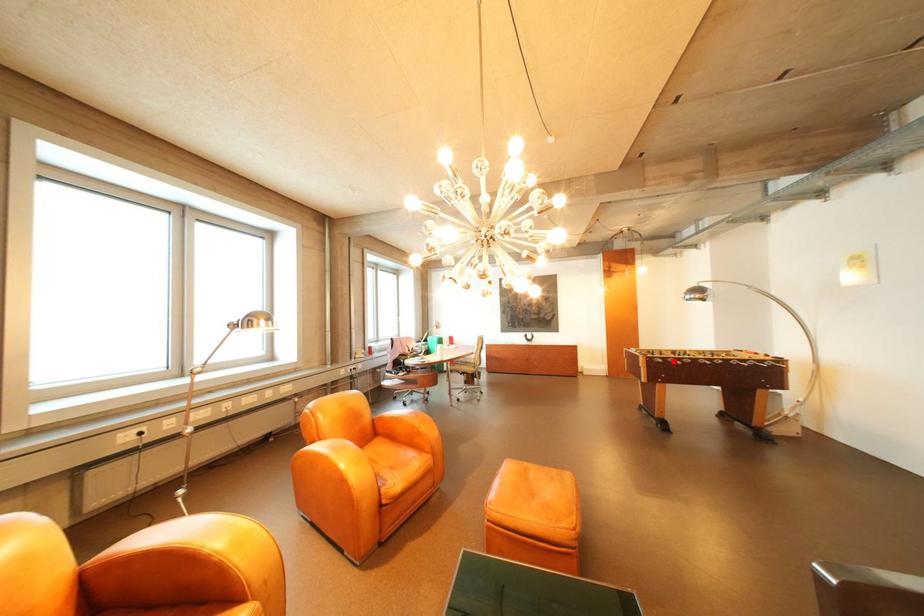
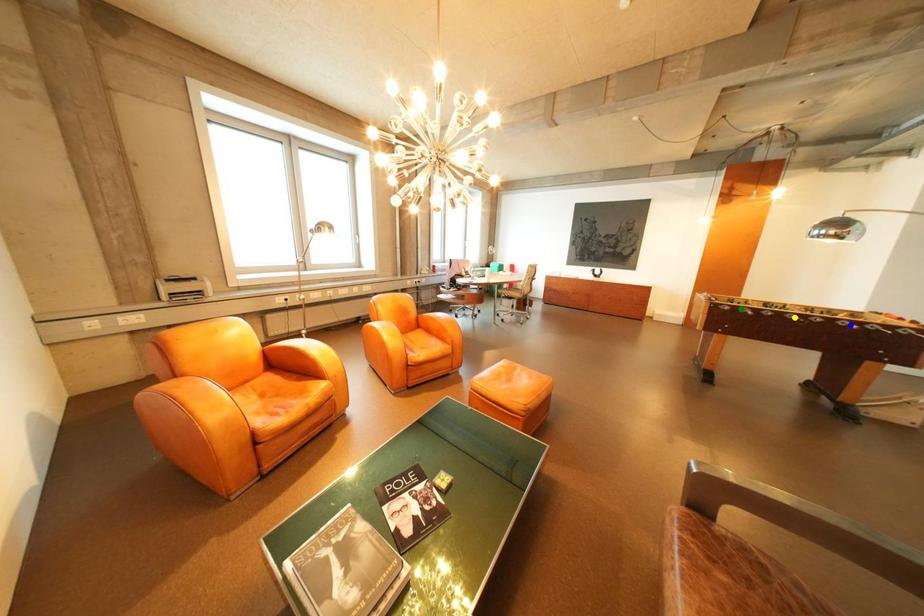
Question: I am providing you with two images of the same scene from different viewpoints. A red point is marked on the first image. You are given multiple points on the second image. Which spot in image 2 lines up with the point in image 1?

Choices:
 (A) blue point
 (B) green point
 (C) yellow point

Answer: (B)